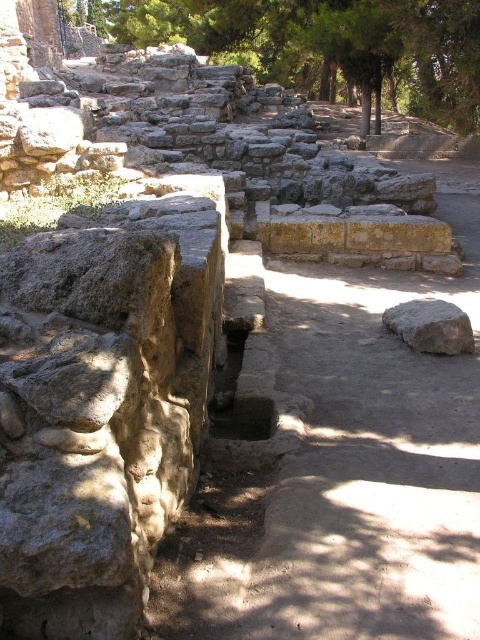
Does point (230, 8) come farther from viewer compared to point (458, 326)?

Yes, it is behind point (458, 326).

The width and height of the screenshot is (480, 640). In order to click on green leafy tree at upper center in this screenshot , I will do `click(330, 45)`.